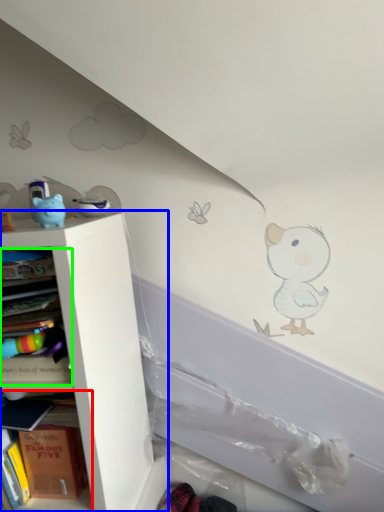
Question: Which object is the closest to the shelf (highlighted by a red box)? Choose among these: shelf (highlighted by a blue box) or book (highlighted by a green box).

Choices:
 (A) shelf
 (B) book

Answer: (B)